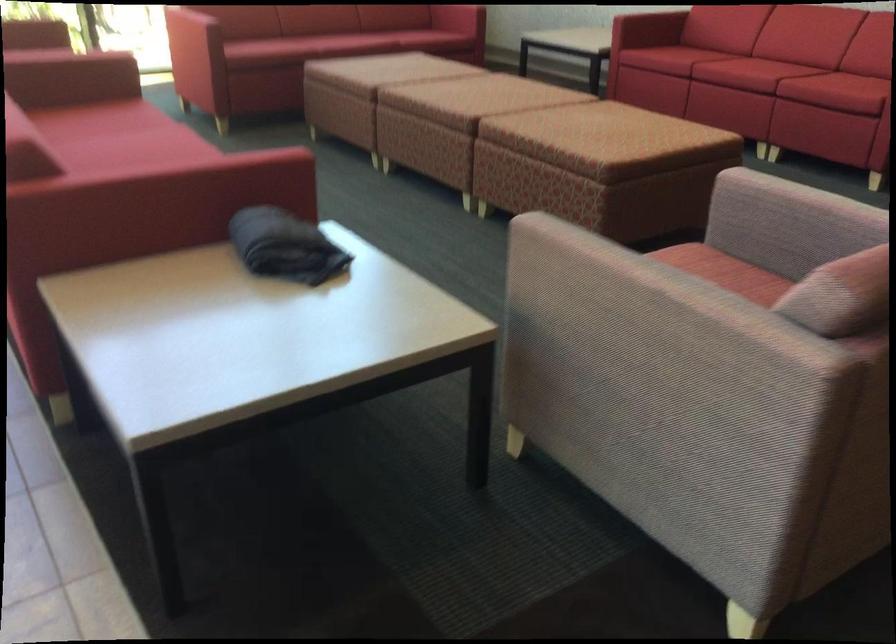
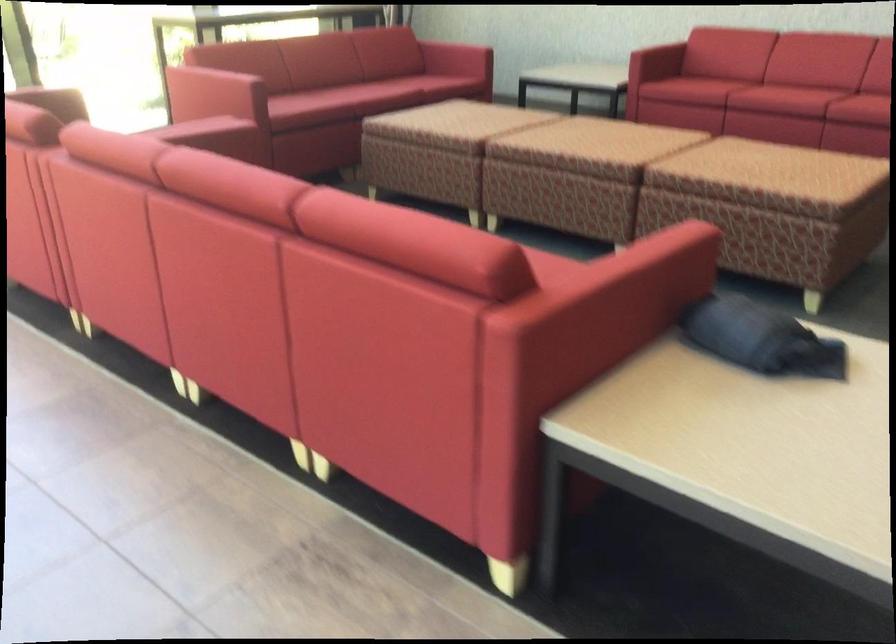
Question: The images are taken continuously from a first-person perspective. In which direction are you moving?

Choices:
 (A) Left
 (B) Right
 (C) Forward
 (D) Backward

Answer: (D)